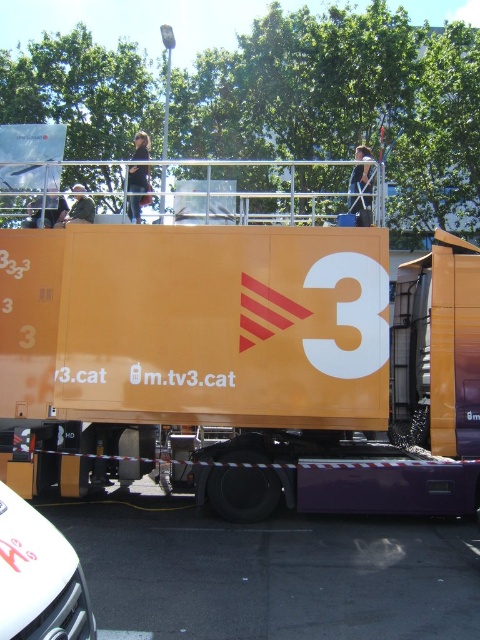
Question: Does orange matte truck at center appear over white glossy car at lower left?

Choices:
 (A) yes
 (B) no

Answer: (A)

Question: Which of the following is the farthest from the observer?

Choices:
 (A) orange matte truck at center
 (B) white glossy car at lower left

Answer: (A)

Question: Does orange matte truck at center appear over white glossy car at lower left?

Choices:
 (A) no
 (B) yes

Answer: (B)

Question: Which of the following is the farthest from the observer?

Choices:
 (A) orange matte truck at center
 (B) white glossy car at lower left

Answer: (A)

Question: Is orange matte truck at center in front of white glossy car at lower left?

Choices:
 (A) yes
 (B) no

Answer: (B)